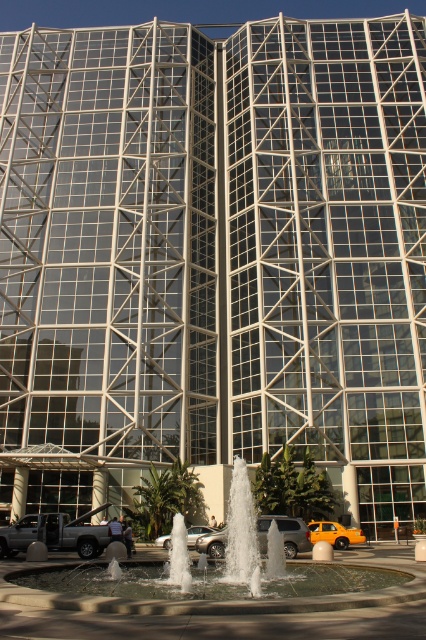
Is silver metallic truck at lower left bigger than metallic silver suv at center?

Yes, silver metallic truck at lower left is bigger than metallic silver suv at center.

Who is taller, silver metallic truck at lower left or metallic silver suv at center?

silver metallic truck at lower left is taller.

Is point (94, 547) farther from viewer compared to point (218, 548)?

No, it is in front of (218, 548).

Identify the location of silver metallic truck at lower left. (54, 534).

Does silver metallic truck at lower left have a greater width compared to silver metallic sedan at center?

Indeed, silver metallic truck at lower left has a greater width compared to silver metallic sedan at center.

Identify the location of silver metallic truck at lower left. The height and width of the screenshot is (640, 426). (54, 534).

Can you confirm if white stone fountain at center is smaller than metallic silver suv at center?

No, white stone fountain at center is not smaller than metallic silver suv at center.

Is white stone fountain at center below metallic silver suv at center?

Incorrect, white stone fountain at center is not positioned below metallic silver suv at center.

Is point (238, 557) closer to viewer compared to point (285, 544)?

Yes, point (238, 557) is closer to viewer.

You are a GUI agent. You are given a task and a screenshot of the screen. Output one action in this format:
    pyautogui.click(x=<x>, y=<y>)
    Task: Click on the white stone fountain at center
    This screenshot has width=426, height=640.
    Given the screenshot: What is the action you would take?
    pyautogui.click(x=115, y=604)